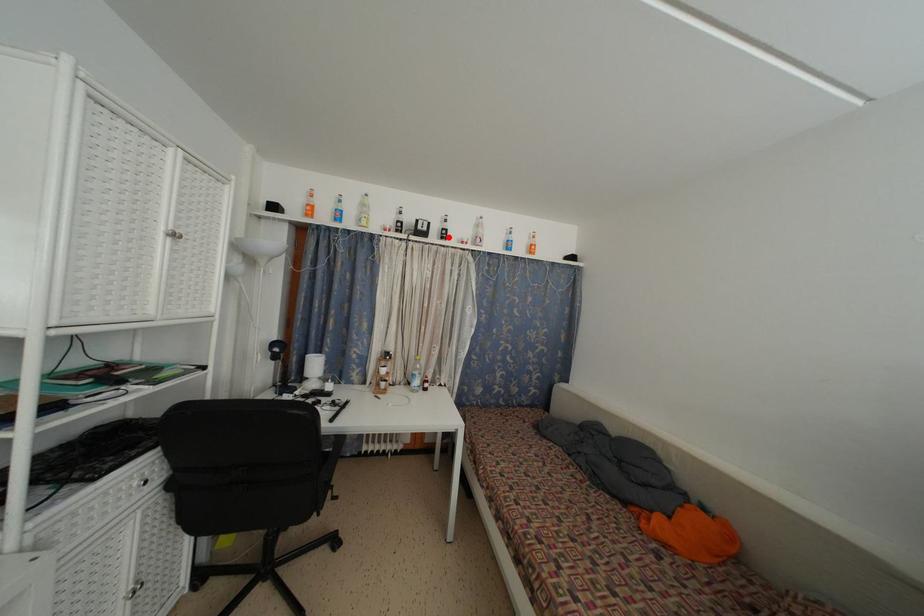
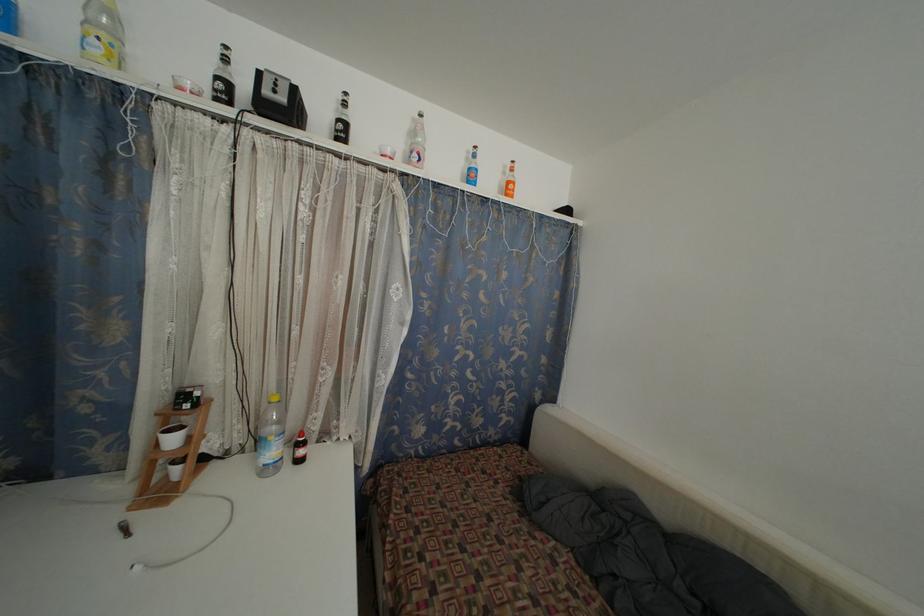
The point at the highlighted location is marked in the first image. Where is the corresponding point in the second image?

(345, 132)